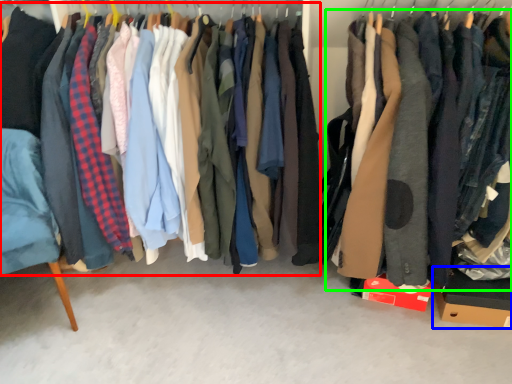
Question: Which object is positioned farthest from closet (highlighted by a red box)? Select from cardboard box (highlighted by a blue box) and clothing (highlighted by a green box).

Choices:
 (A) cardboard box
 (B) clothing

Answer: (A)